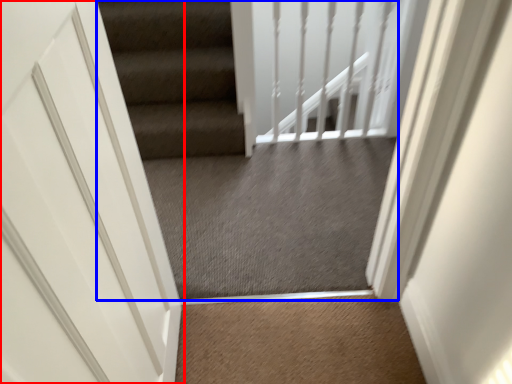
Question: Which of the following is the farthest to the observer, door (highlighted by a red box) or escalator (highlighted by a blue box)?

Choices:
 (A) door
 (B) escalator

Answer: (B)